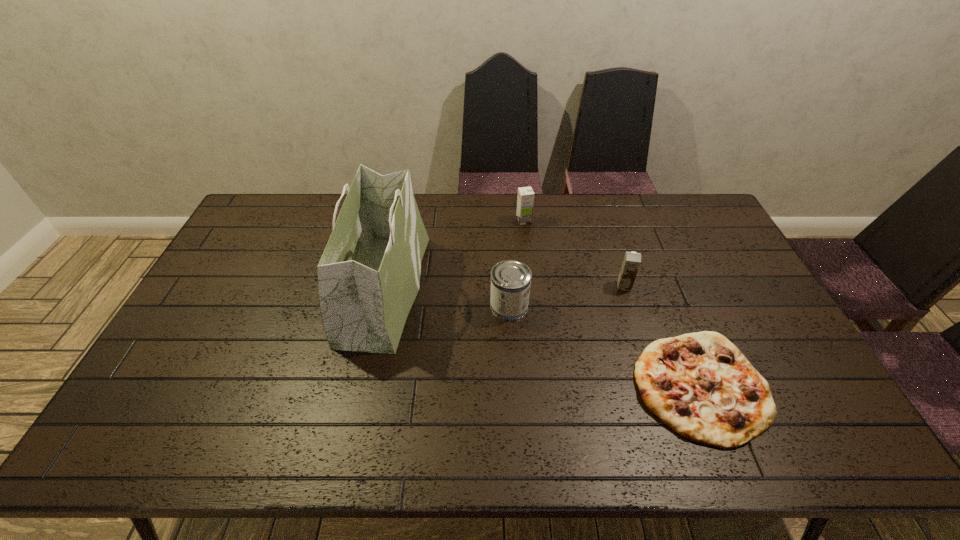
Locate an element on the screen. This screenshot has width=960, height=540. the tallest object is located at coordinates (364, 302).

Locate an element on the screen. This screenshot has height=540, width=960. grocery bag is located at coordinates (364, 302).

Identify the location of the left chocolate milk. (525, 200).

Image resolution: width=960 pixels, height=540 pixels. Find the location of `the farther chocolate milk`. the farther chocolate milk is located at coordinates (525, 200).

You are a GUI agent. You are given a task and a screenshot of the screen. Output one action in this format:
    pyautogui.click(x=<x>, y=<y>)
    Task: Click on the nearer chocolate milk
    Image resolution: width=960 pixels, height=540 pixels.
    Given the screenshot: What is the action you would take?
    pyautogui.click(x=632, y=260)

You are a GUI agent. You are given a task and a screenshot of the screen. Output one action in this format:
    pyautogui.click(x=<x>, y=<y>)
    Task: Click on the can
    The width and height of the screenshot is (960, 540).
    Given the screenshot: What is the action you would take?
    pyautogui.click(x=510, y=280)

Image resolution: width=960 pixels, height=540 pixels. What are the coordinates of `pizza` in the screenshot? It's located at (700, 385).

The width and height of the screenshot is (960, 540). I want to click on vacant space located on the back of the grocery bag, so click(x=402, y=206).

I want to click on vacant area located 0.210m on the left of the farthest object, so click(459, 221).

In order to click on free region located on the back of the nearer chocolate milk in this screenshot , I will do `click(600, 212)`.